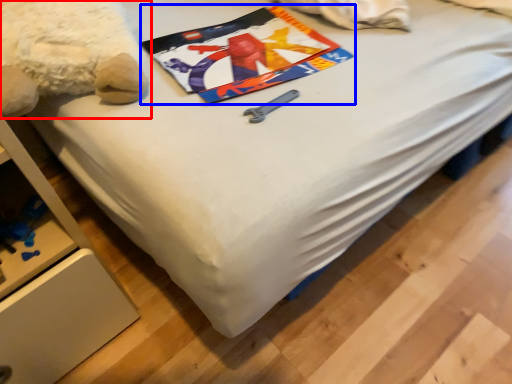
Question: Which object is closer to the camera taking this photo, teddy bear (highlighted by a red box) or design (highlighted by a blue box)?

Choices:
 (A) teddy bear
 (B) design

Answer: (A)